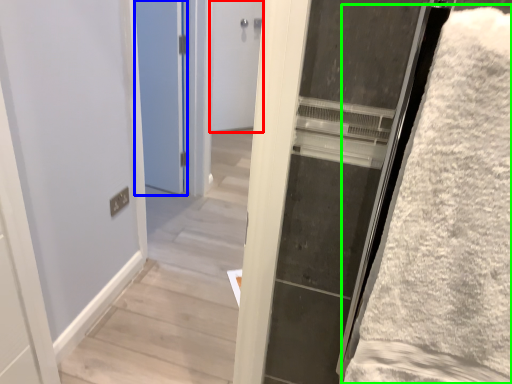
Question: Based on their relative distances, which object is farther from door (highlighted by a red box)? Choose from door (highlighted by a blue box) and bath towel (highlighted by a green box).

Choices:
 (A) door
 (B) bath towel

Answer: (B)